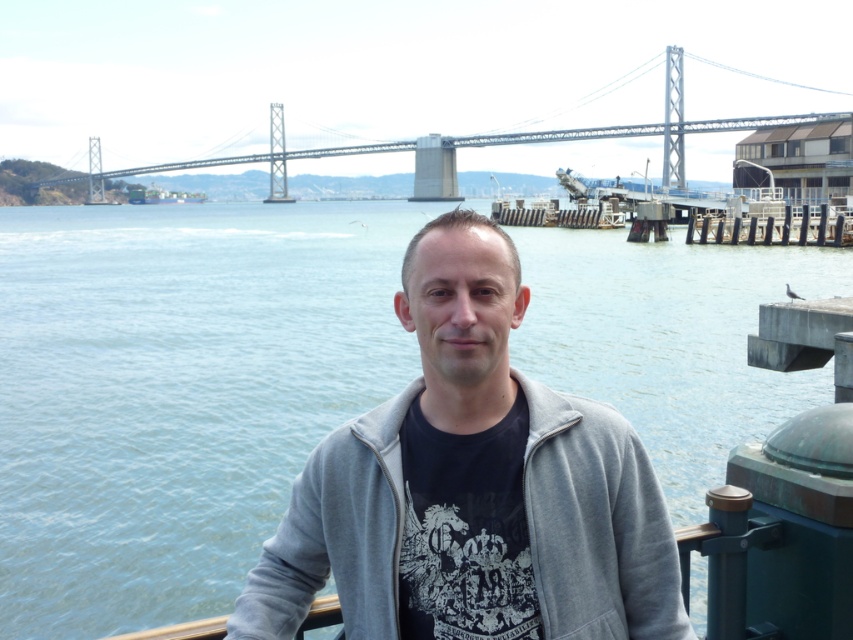
You are a photographer trying to capture the Oakland Bay Bridge in the background while including the person in your shot. Since the gray fleece jacket at center and the metallic gray bridge at upper center are both in your viewfinder, which object should you focus on first to ensure both are in frame?

The gray fleece jacket at center is to the right of the metallic gray bridge at upper center, so you should focus on the metallic gray bridge at upper center first to ensure both are in frame.

You are a photographer trying to capture a photo of the metallic gray bridge at upper center while standing near the gray fleece jacket at center. Since you want to include both the jacket and the bridge in the frame, will the jacket fit entirely within the photo if the bridge takes up most of the width?

The gray fleece jacket at center has a smaller width than the metallic gray bridge at upper center. Since the bridge takes up most of the width in the photo, the jacket will still fit entirely within the frame as its width is narrower than the bridge.